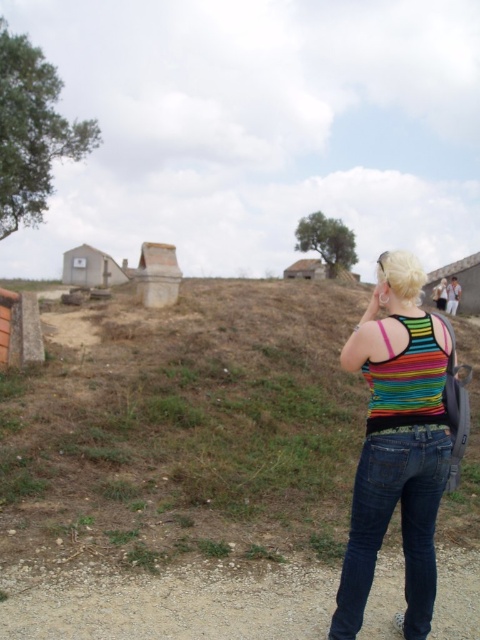
Between rainbow striped tank top at right and white corrugated metal hut at lower left, which one has more height?

Standing taller between the two is white corrugated metal hut at lower left.

Who is positioned more to the left, rainbow striped tank top at right or white corrugated metal hut at lower left?

white corrugated metal hut at lower left is more to the left.

Is point (430, 472) positioned after point (67, 252)?

No.

At what (x,y) coordinates should I click in order to perform the action: click on rainbow striped tank top at right. Please return your answer as a coordinate pair (x, y). Looking at the image, I should click on (396, 444).

Can you confirm if brown grassy hillside at center is shorter than rainbow striped tank top at right?

In fact, brown grassy hillside at center may be taller than rainbow striped tank top at right.

Between brown grassy hillside at center and rainbow striped tank top at right, which one is positioned higher?

brown grassy hillside at center is higher up.

Is point (199, 344) farther from camera compared to point (417, 474)?

Yes, point (199, 344) is farther from viewer.

At what (x,y) coordinates should I click in order to perform the action: click on brown grassy hillside at center. Please return your answer as a coordinate pair (x, y). This screenshot has height=640, width=480. Looking at the image, I should click on (188, 429).

Is brown grassy hillside at center positioned at the back of white corrugated metal hut at lower left?

No.

Which of these two, brown grassy hillside at center or white corrugated metal hut at lower left, stands shorter?

Standing shorter between the two is brown grassy hillside at center.

At what (x,y) coordinates should I click in order to perform the action: click on brown grassy hillside at center. Please return your answer as a coordinate pair (x, y). The width and height of the screenshot is (480, 640). Looking at the image, I should click on (188, 429).

Find the location of a particular element. brown grassy hillside at center is located at coordinates (188, 429).